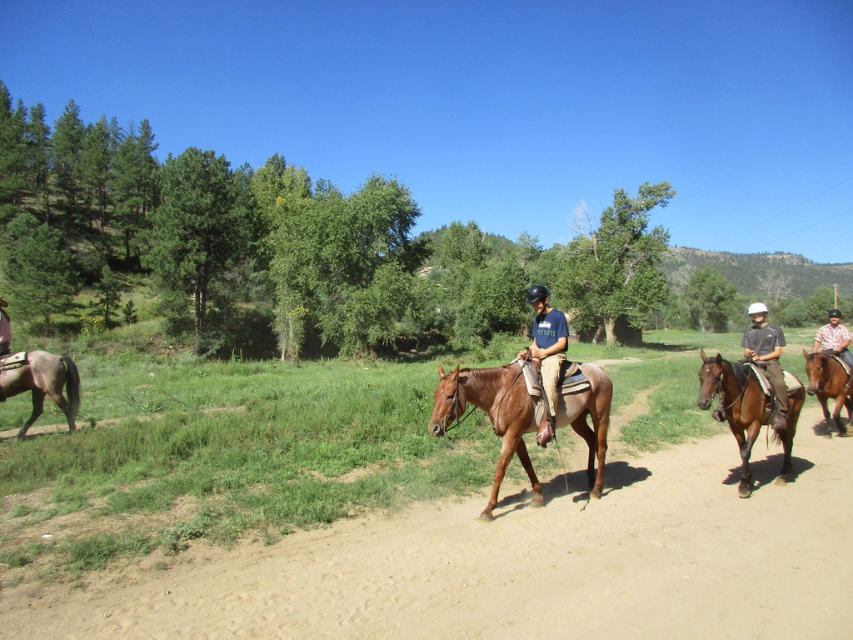
You are a photographer positioned at the origin of the coordinate system. You want to capture a photo of the brown glossy horse at center right. The camera can only focus on objects within a 0.5 unit radius from the point you choose. If you choose to focus on point (735, 404), will the brown glossy horse at center right be in focus?

Yes, because the point (735, 404) corresponds to the brown glossy horse at center right, so focusing there would place it within the 0.5 unit radius, ensuring it is in focus.